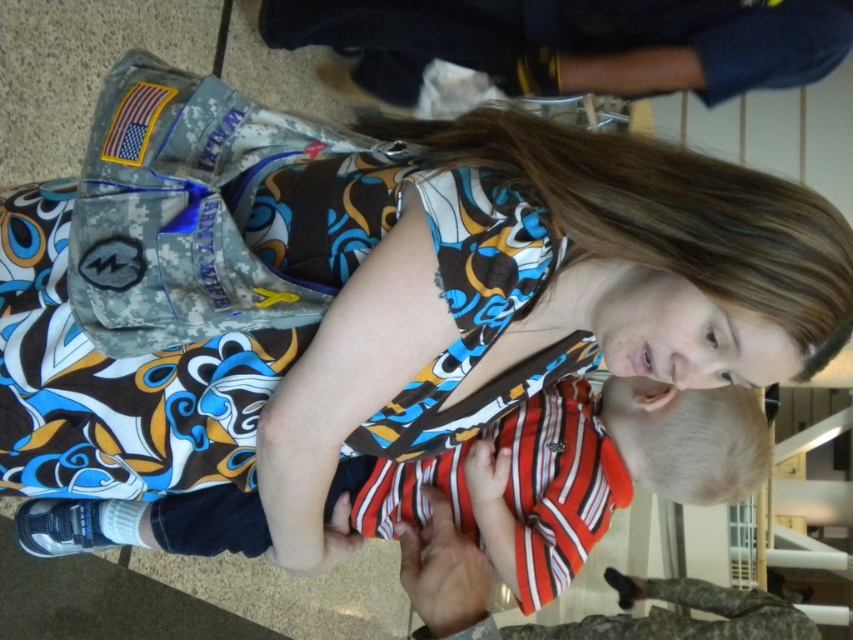
You are an airport security officer observing two travelers at the checkpoint. The travelers are wearing a printed fabric dress at center and a striped cotton shirt at center. Which clothing item is positioned higher on their bodies?

The printed fabric dress at center is located above the striped cotton shirt at center, so the printed fabric dress at center is positioned higher on their bodies.

You are a photographer trying to capture a candid shot of the printed fabric dress at center and the striped cotton shirt at center. Since you want to highlight both, which one should you position to the left in your camera frame?

The printed fabric dress at center is already positioned on the left side of the striped cotton shirt at center, so to highlight both, you should keep the printed fabric dress at center on the left and the striped cotton shirt at center on the right in your camera frame.